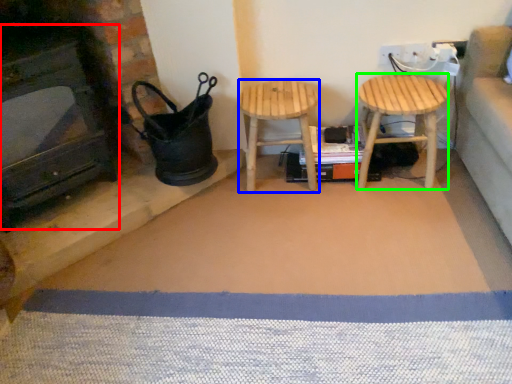
Question: Which is farther away from fireplace (highlighted by a red box)? stool (highlighted by a blue box) or stool (highlighted by a green box)?

Choices:
 (A) stool
 (B) stool

Answer: (B)